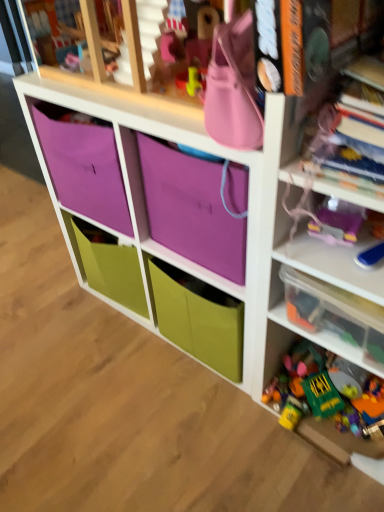
You are a GUI agent. You are given a task and a screenshot of the screen. Output one action in this format:
    pyautogui.click(x=<x>, y=<y>)
    Task: Click on the vacant area situated to the left side of translucent plastic toys at right
    The image size is (384, 512).
    Given the screenshot: What is the action you would take?
    pyautogui.click(x=213, y=434)